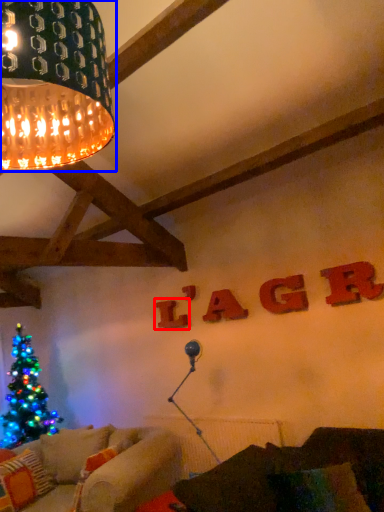
Question: Which object is closer to the camera taking this photo, letter (highlighted by a red box) or lamp (highlighted by a blue box)?

Choices:
 (A) letter
 (B) lamp

Answer: (B)